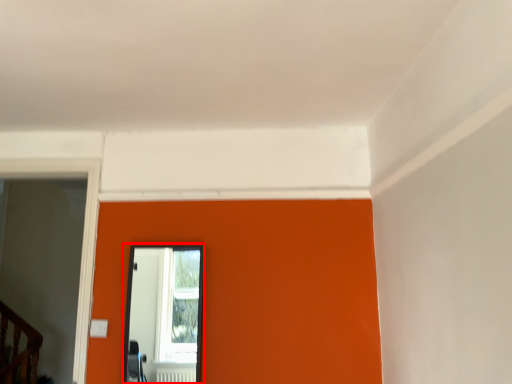
Question: From the image's perspective, what is the correct spatial positioning of mirror (annotated by the red box) in reference to glass door?

Choices:
 (A) below
 (B) above

Answer: (A)